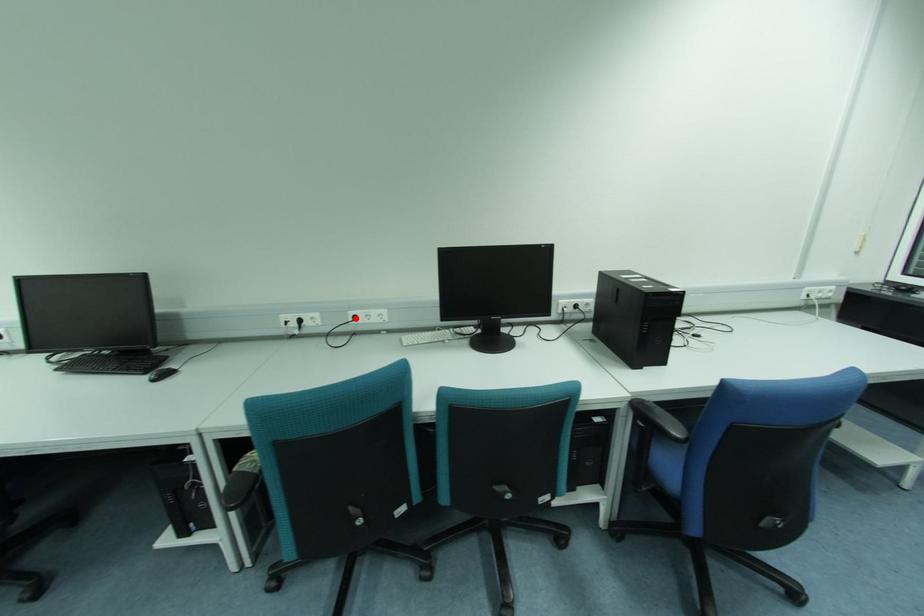
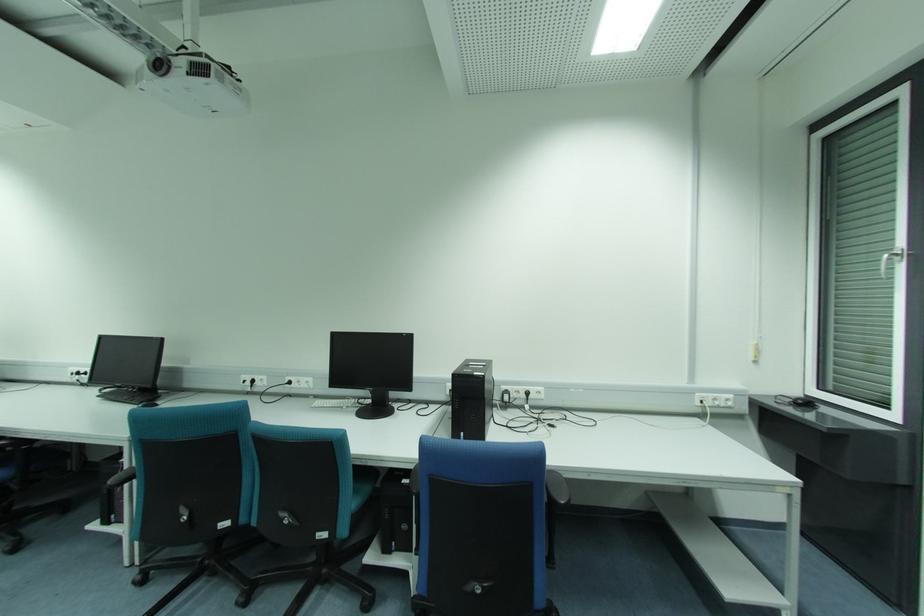
Locate, in the second image, the point that corresponds to the highlighted location in the first image.

(289, 383)